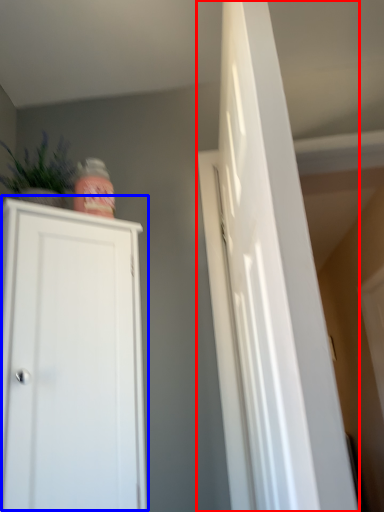
Question: Which object appears closest to the camera in this image, door (highlighted by a red box) or cupboard (highlighted by a blue box)?

Choices:
 (A) door
 (B) cupboard

Answer: (A)